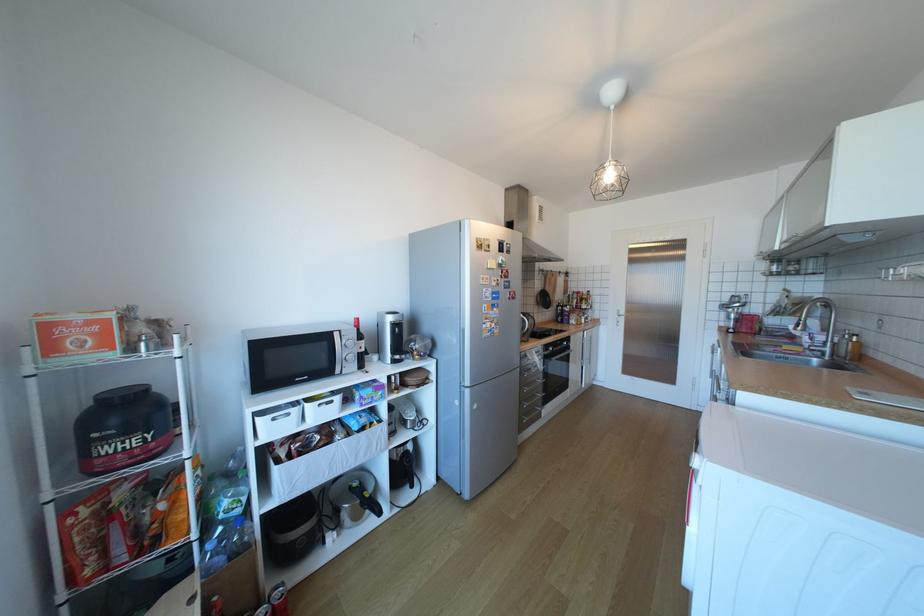
Image resolution: width=924 pixels, height=616 pixels. What are the coordinates of `orange cardboard box` in the screenshot? It's located at (76, 334).